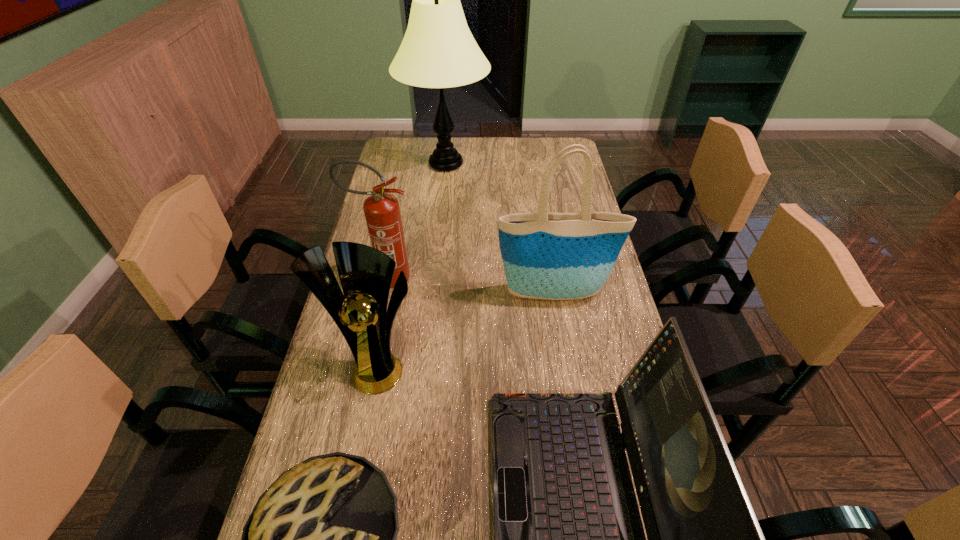
Locate an element on the screen. unoccupied position between the fire extinguisher and the tote bag is located at coordinates (470, 286).

Identify which object is the fourth closest to the lamp. Please provide its 2D coordinates. Your answer should be formatted as a tuple, i.e. [(x, y)], where the tuple contains the x and y coordinates of a point satisfying the conditions above.

[(568, 537)]

Identify which object is the nearest to the fire extinguisher. Please provide its 2D coordinates. Your answer should be formatted as a tuple, i.e. [(x, y)], where the tuple contains the x and y coordinates of a point satisfying the conditions above.

[(361, 314)]